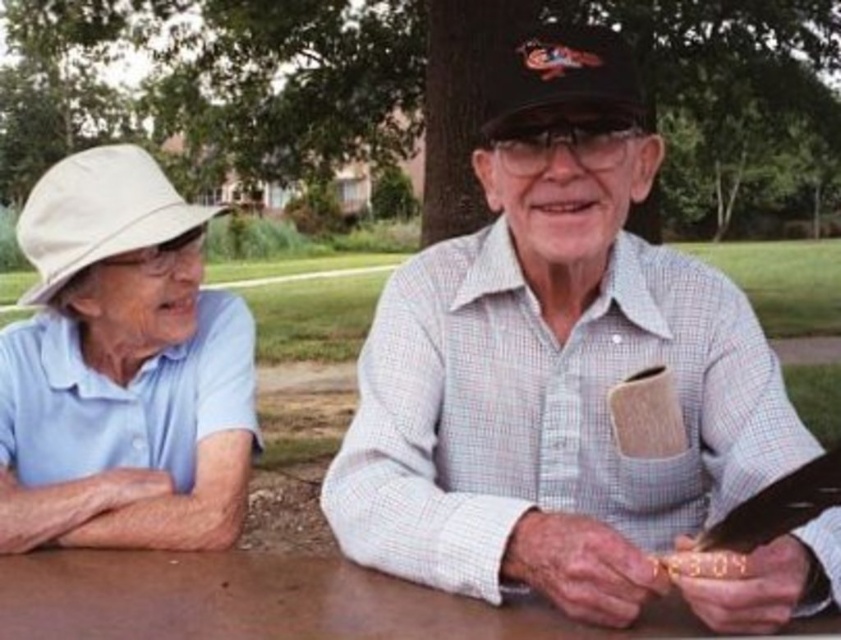
You are a photographer trying to capture a portrait of both the white checkered shirt at center and the white fabric baseball hat at left. Since you want to ensure both subjects are fully visible in the frame, which object should you adjust the camera focus to prioritize based on their sizes?

The white checkered shirt at center has a lesser width compared to the white fabric baseball hat at left, so you should prioritize focusing on the white fabric baseball hat at left to ensure it is fully visible in the frame.

You are a photographer taking a picture of the scene. You want to focus on the white checkered shirt at center and the black textured baseball cap at center. Which object should you adjust your focus to first to ensure both are in the frame?

You should focus on the white checkered shirt at center first because it is closer to the viewer than the black textured baseball cap at center, ensuring both will be in the frame when adjusted properly.

You are a photographer standing in front of the picnic table. You want to take a closeup photo of the white fabric hat at left without including the person wearing it. Is the hat close enough to focus on clearly?

The white fabric hat at left is 1.29 meters away from the viewer. Since this distance is within typical camera focusing range, you can take a clear closeup photo of the white fabric hat at left without including the person wearing it.